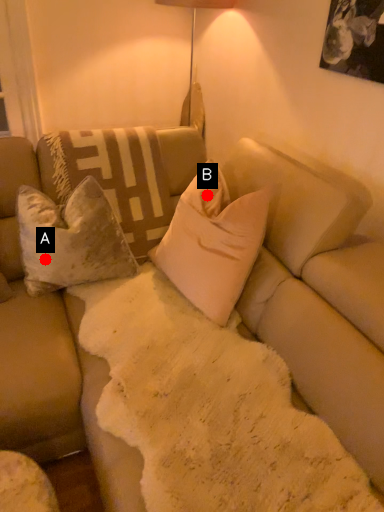
Question: Two points are circled on the image, labeled by A and B beside each circle. Among these points, which one is nearest to the camera?

Choices:
 (A) A is closer
 (B) B is closer

Answer: (A)